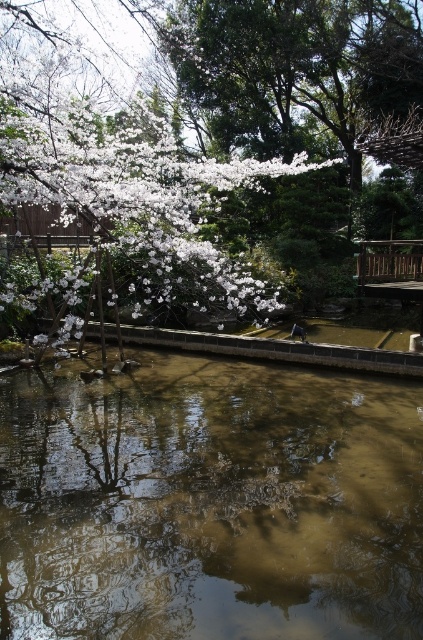
Consider the image. You are standing in the garden looking at the pond. There are two points marked in the scene, one at coordinates point (60, 522) and the other at point (206, 275). Which point is nearer to your current position?

Point (60, 522) is closer to the camera than point (206, 275), so the point at coordinates point (60, 522) is nearer to your current position.

You are a photographer planning to capture the serene garden scene. You need to ensure that the brown reflective water at center and the white blossoms at upper left are both visible in your shot. Which object will occupy a larger portion of the photo?

The white blossoms at upper left will occupy a larger portion of the photo since the brown reflective water at center is smaller than them according to the description.